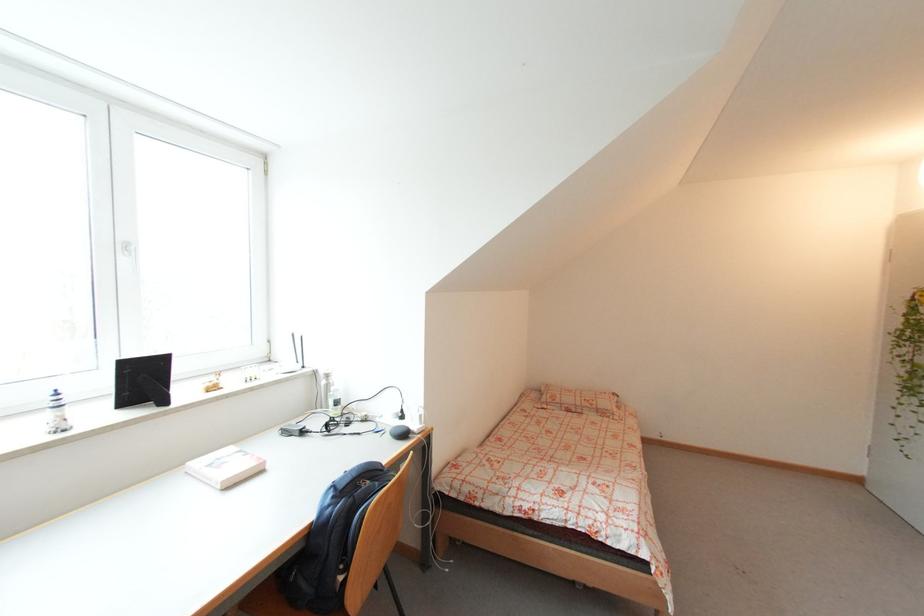
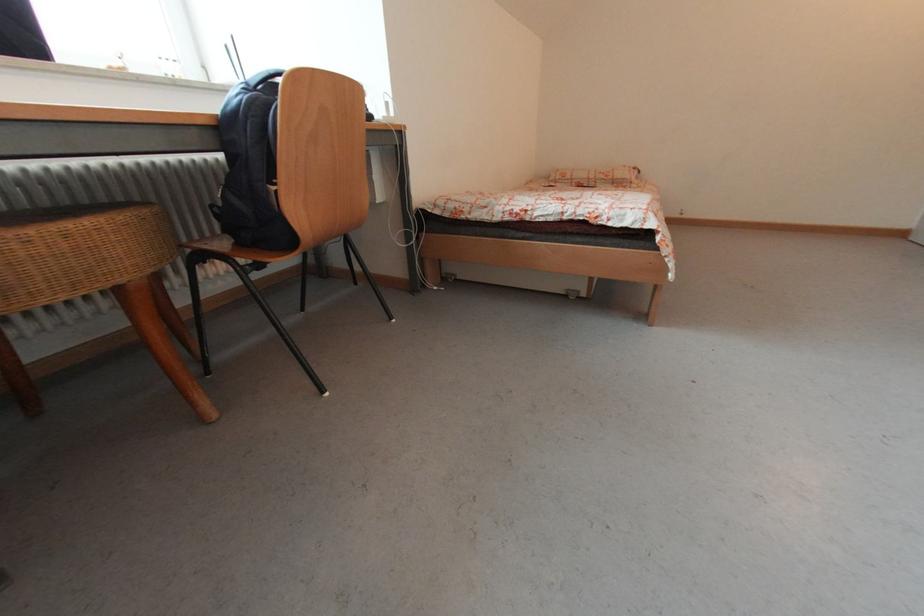
Question: The first image is from the beginning of the video and the second image is from the end. How did the camera likely rotate when shooting the video?

Choices:
 (A) Left
 (B) Right
 (C) Up
 (D) Down

Answer: (D)